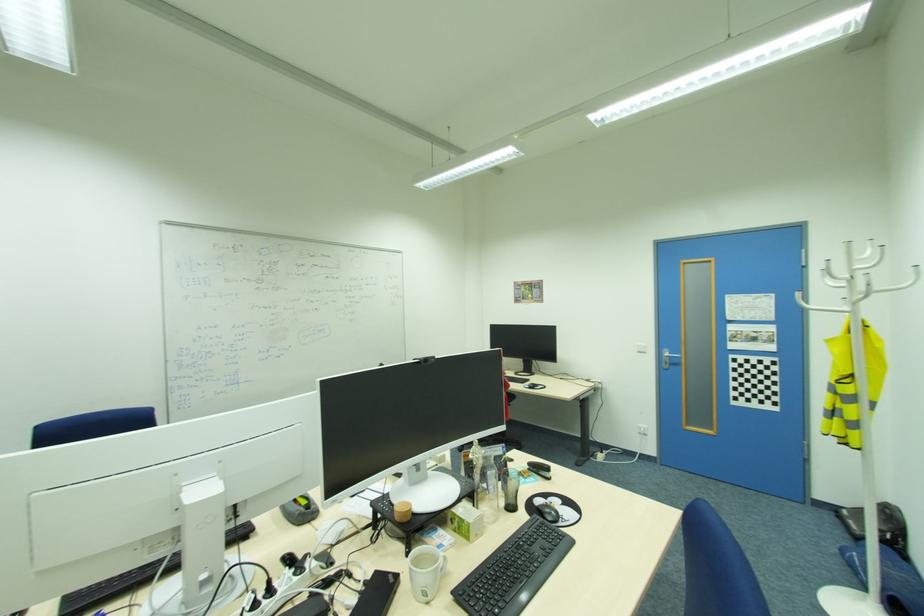
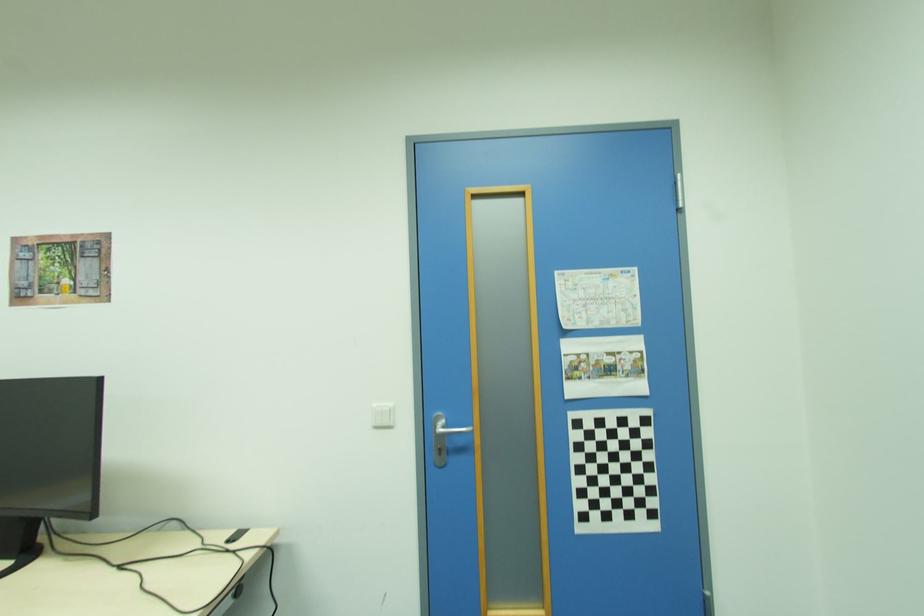
Where in the second image is the point corresponding to point 750,318 from the first image?

(599, 325)